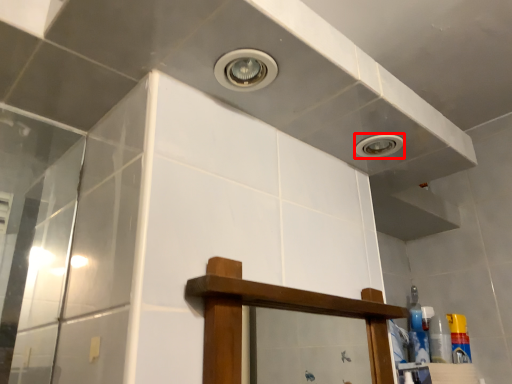
Question: Observing the image, what is the correct spatial positioning of droplight (annotated by the red box) in reference to toiletry?

Choices:
 (A) left
 (B) right

Answer: (A)